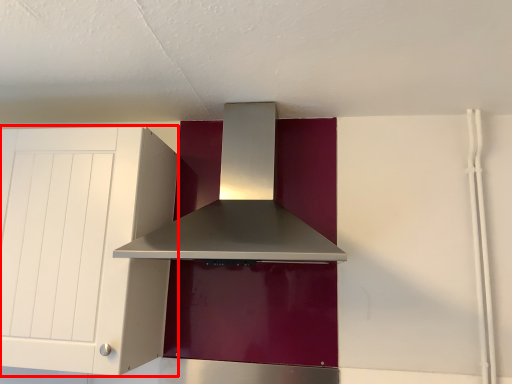
Question: From the image's perspective, where is cabinetry (annotated by the red box) located relative to home appliance?

Choices:
 (A) below
 (B) above

Answer: (A)